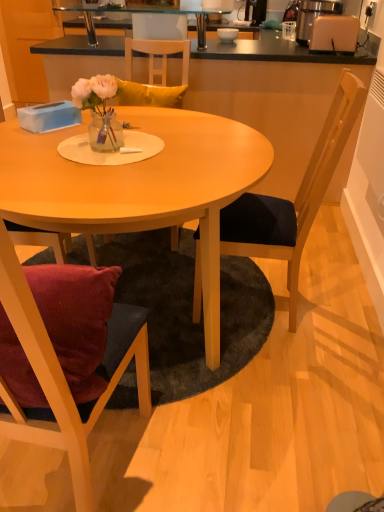
Find the location of `vacant space situated on the left part of white plastic toaster at upper right`. vacant space situated on the left part of white plastic toaster at upper right is located at coordinates (299, 49).